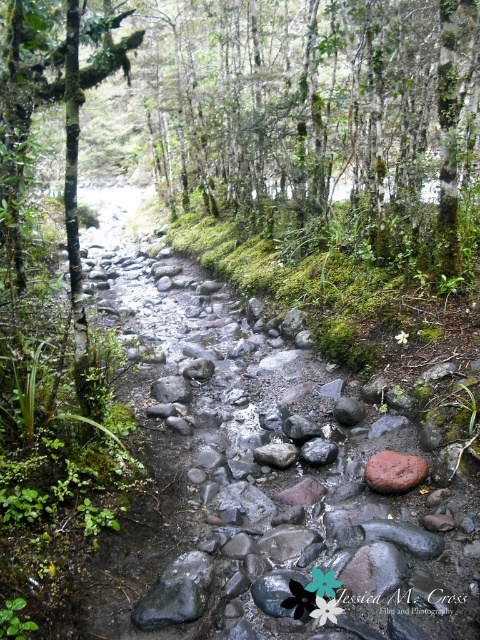
You are a hiker trying to cross the stream. You see the green mossy tree at upper center and the gray smooth rock at center. Which object is closer to you as you approach the stream from the upper part of the image?

The green mossy tree at upper center is closer to you because it is in front of the gray smooth rock at center, which is positioned behind it.